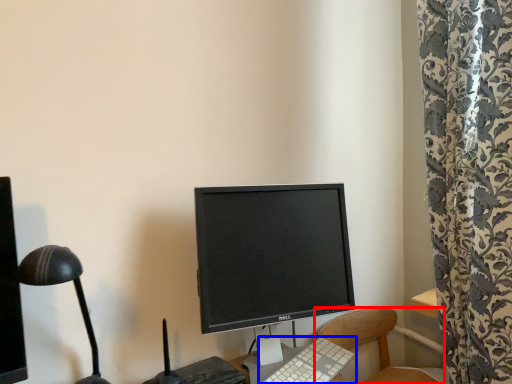
Question: Which object is closer to the camera taking this photo, chair (highlighted by a red box) or computer keyboard (highlighted by a blue box)?

Choices:
 (A) chair
 (B) computer keyboard

Answer: (B)